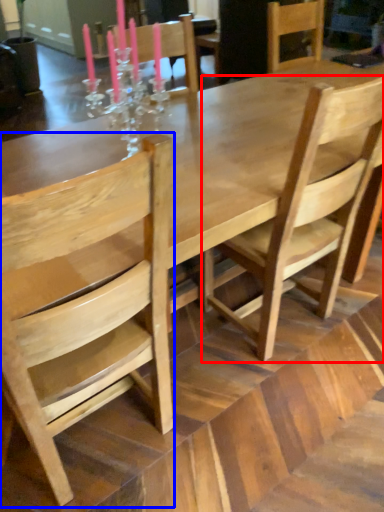
Question: Which point is further to the camera, chair (highlighted by a red box) or chair (highlighted by a blue box)?

Choices:
 (A) chair
 (B) chair

Answer: (A)